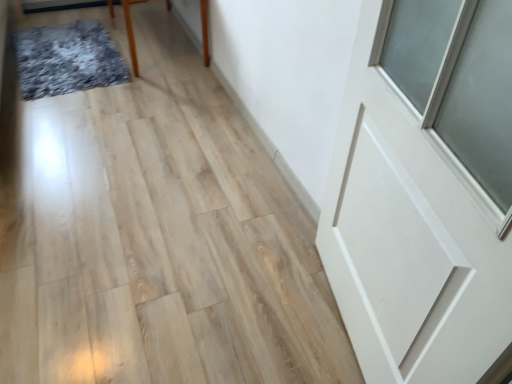
Question: From the image's perspective, is textured gray mat at upper left on white matte door at upper right?

Choices:
 (A) no
 (B) yes

Answer: (B)

Question: Does textured gray mat at upper left have a greater height compared to white matte door at upper right?

Choices:
 (A) yes
 (B) no

Answer: (B)

Question: Does textured gray mat at upper left appear on the left side of white matte door at upper right?

Choices:
 (A) yes
 (B) no

Answer: (A)

Question: From a real-world perspective, does textured gray mat at upper left stand above white matte door at upper right?

Choices:
 (A) no
 (B) yes

Answer: (A)

Question: Does textured gray mat at upper left lie in front of white matte door at upper right?

Choices:
 (A) no
 (B) yes

Answer: (A)

Question: Are textured gray mat at upper left and white matte door at upper right located far from each other?

Choices:
 (A) no
 (B) yes

Answer: (B)

Question: Does white matte door at upper right have a lesser width compared to brown wooden table at upper left?

Choices:
 (A) yes
 (B) no

Answer: (A)

Question: Does white matte door at upper right have a greater height compared to brown wooden table at upper left?

Choices:
 (A) yes
 (B) no

Answer: (A)

Question: From a real-world perspective, is white matte door at upper right on brown wooden table at upper left?

Choices:
 (A) no
 (B) yes

Answer: (B)

Question: Is brown wooden table at upper left located within white matte door at upper right?

Choices:
 (A) yes
 (B) no

Answer: (B)

Question: Is white matte door at upper right bigger than brown wooden table at upper left?

Choices:
 (A) no
 (B) yes

Answer: (A)

Question: From a real-world perspective, does white matte door at upper right sit lower than brown wooden table at upper left?

Choices:
 (A) yes
 (B) no

Answer: (B)

Question: Considering the relative sizes of brown wooden table at upper left and white matte door at upper right in the image provided, is brown wooden table at upper left smaller than white matte door at upper right?

Choices:
 (A) no
 (B) yes

Answer: (A)